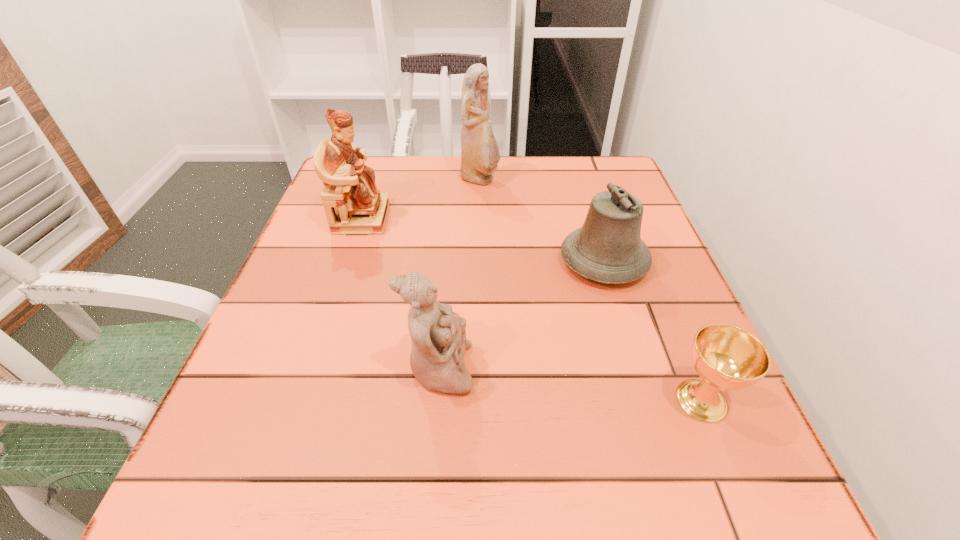
At what (x,y) coordinates should I click in order to perform the action: click on free point at the far right corner. Please return your answer as a coordinate pair (x, y). The height and width of the screenshot is (540, 960). Looking at the image, I should click on (599, 166).

Where is `vacant space at the near right corner`? This screenshot has height=540, width=960. vacant space at the near right corner is located at coordinates (734, 461).

You are a GUI agent. You are given a task and a screenshot of the screen. Output one action in this format:
    pyautogui.click(x=<x>, y=<y>)
    Task: Click on the vacant space in between the shortest object and the second nearest figurine
    The image size is (960, 540).
    Given the screenshot: What is the action you would take?
    pyautogui.click(x=532, y=309)

Identify the location of vacant area between the farthest object and the chalice. The image size is (960, 540). (590, 290).

I want to click on free space between the farthest object and the chalice, so click(590, 290).

The width and height of the screenshot is (960, 540). I want to click on free space between the bell and the second farthest figurine, so click(483, 240).

I want to click on vacant area that lies between the farthest object and the leftmost figurine, so pos(420,199).

The height and width of the screenshot is (540, 960). Find the location of `unoccupied position between the farthest figurine and the third shortest object`. unoccupied position between the farthest figurine and the third shortest object is located at coordinates (459, 274).

Find the location of a particular element. vacant area that lies between the chalice and the fourth tallest object is located at coordinates (653, 330).

The height and width of the screenshot is (540, 960). Identify the location of blank region between the second nearest figurine and the bell. (483, 240).